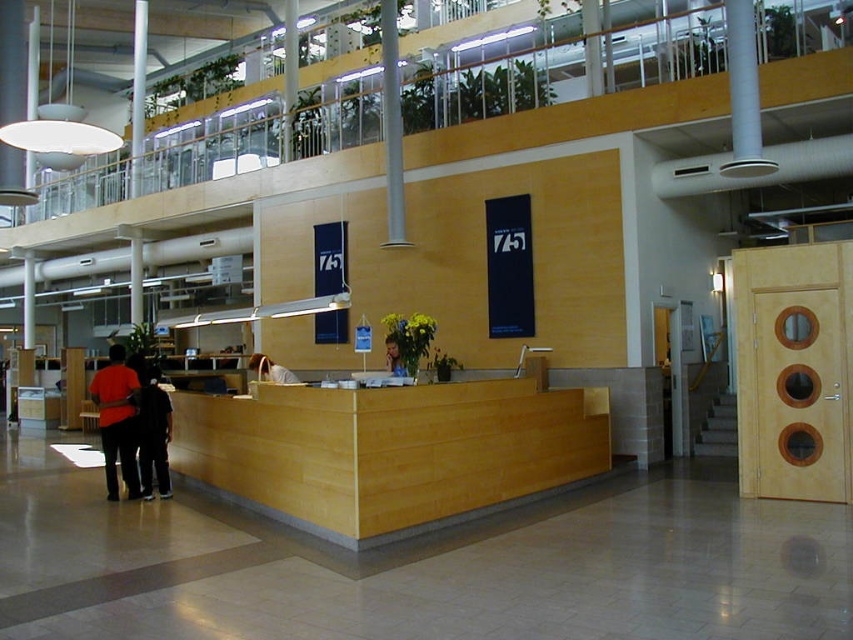
Question: In this image, where is orange shirt at lower left located relative to dark clothing at lower left?

Choices:
 (A) above
 (B) below

Answer: (B)

Question: Does dark clothing at lower left come behind smooth blue shirt at center?

Choices:
 (A) yes
 (B) no

Answer: (A)

Question: Which of these objects is positioned farthest from the smooth blue shirt at center?

Choices:
 (A) orange shirt at lower left
 (B) light brown leather bag at center
 (C) dark clothing at lower left

Answer: (A)

Question: Does orange shirt at lower left have a lesser width compared to smooth blue shirt at center?

Choices:
 (A) yes
 (B) no

Answer: (B)

Question: Which object is farther from the camera taking this photo?

Choices:
 (A) light brown leather bag at center
 (B) smooth blue shirt at center

Answer: (A)

Question: Considering the real-world distances, which object is closest to the smooth blue shirt at center?

Choices:
 (A) light wood/woodenobject at center
 (B) light brown leather bag at center

Answer: (A)